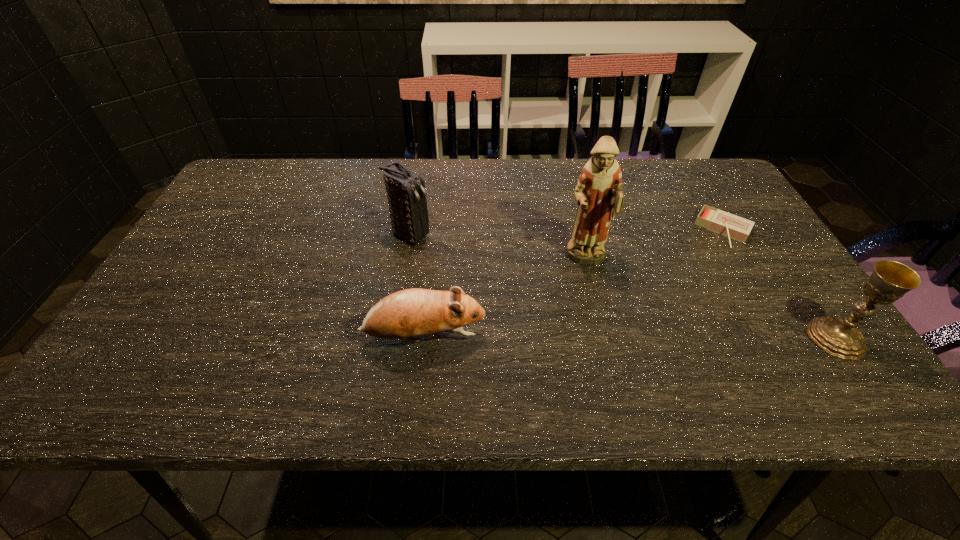
Image resolution: width=960 pixels, height=540 pixels. Find the location of `matchbox located in the right edge section of the desktop`. matchbox located in the right edge section of the desktop is located at coordinates (735, 227).

Identify the location of object that is at the near right corner. (890, 280).

Image resolution: width=960 pixels, height=540 pixels. What are the coordinates of `vacant region at the far edge of the desktop` in the screenshot? It's located at (311, 185).

Identify the location of vacant area at the near edge. (537, 357).

This screenshot has width=960, height=540. I want to click on vacant space at the left edge, so click(x=238, y=209).

What are the coordinates of `vacant position at the far left corner of the desktop` in the screenshot? It's located at (260, 159).

Image resolution: width=960 pixels, height=540 pixels. I want to click on vacant space at the far right corner of the desktop, so 726,201.

The width and height of the screenshot is (960, 540). What are the coordinates of `unoccupied area between the clutch bag and the third object from right to left` in the screenshot? It's located at (498, 248).

Find the location of a particular element. vacant region between the matchbox and the tallest object is located at coordinates (655, 245).

Locate an element on the screen. This screenshot has width=960, height=540. vacant area that lies between the clutch bag and the chalice is located at coordinates (623, 287).